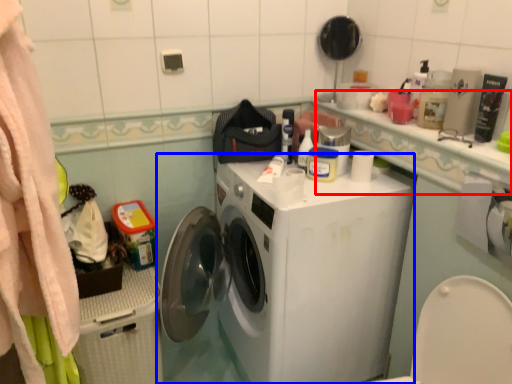
Question: Which object is closer to the camera taking this photo, counter top (highlighted by a red box) or washing machine (highlighted by a blue box)?

Choices:
 (A) counter top
 (B) washing machine

Answer: (A)